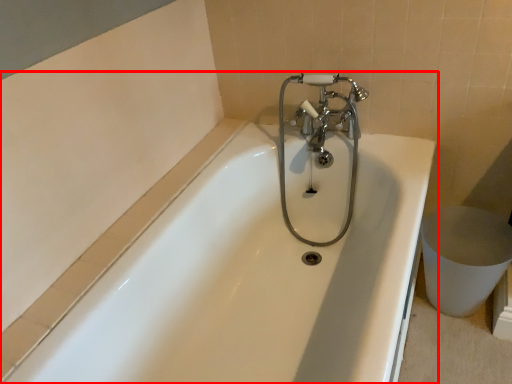
Question: From the image's perspective, where is bathtub (annotated by the red box) located in relation to tap in the image?

Choices:
 (A) below
 (B) above

Answer: (A)